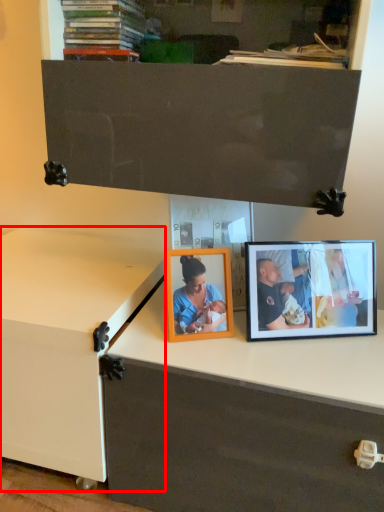
Question: Considering the relative positions of changing table (annotated by the red box) and picture frame in the image provided, where is changing table (annotated by the red box) located with respect to the staircase?

Choices:
 (A) right
 (B) left

Answer: (B)